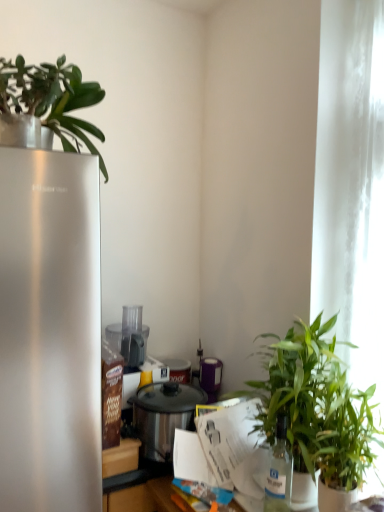
Question: In terms of height, does white glossy paper at center look taller or shorter compared to white sheer curtain at right?

Choices:
 (A) tall
 (B) short

Answer: (B)

Question: From the image's perspective, is white glossy paper at center located above or below white sheer curtain at right?

Choices:
 (A) above
 (B) below

Answer: (B)

Question: Based on their relative distances, which object is farther from the green leafy plant at right, the third houseplant positioned from the left?

Choices:
 (A) green leafy plant at right, the second houseplant when ordered from bottom to top
 (B) green matte plant at upper left, the third houseplant positioned from the right
 (C) white ceramic pot at lower right
 (D) white sheer curtain at right
 (E) stainless steel pot at center

Answer: (B)

Question: Based on their relative distances, which object is nearer to the stainless steel pot at center?

Choices:
 (A) white ceramic pot at lower right
 (B) green leafy plant at right, the second houseplant in the left-to-right sequence
 (C) green leafy plant at right, the 1th houseplant in the bottom-to-top sequence
 (D) green matte plant at upper left, the third houseplant positioned from the right
 (E) white glossy paper at center

Answer: (E)